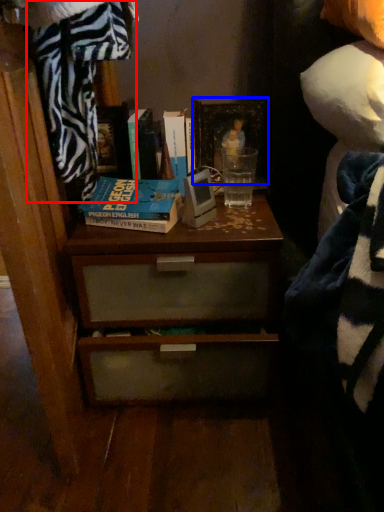
Question: Which object appears closest to the camera in this image, blanket (highlighted by a red box) or picture frame (highlighted by a blue box)?

Choices:
 (A) blanket
 (B) picture frame

Answer: (A)